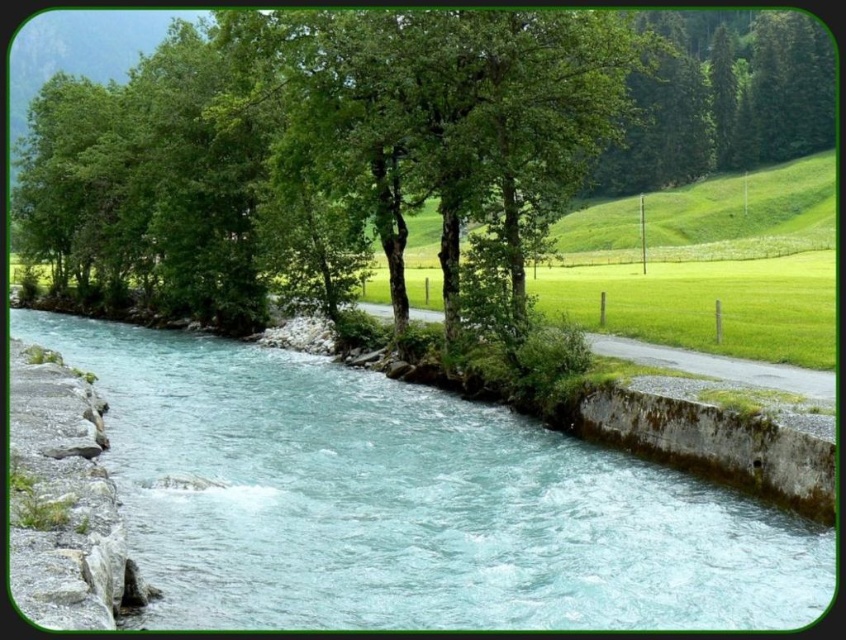
Which is more to the left, clear water at center or green leafy tree at upper center?

clear water at center is more to the left.

Who is higher up, clear water at center or green leafy tree at upper center?

Positioned higher is green leafy tree at upper center.

Is point (544, 609) positioned behind point (146, 48)?

No, it is not.

Locate an element on the screen. clear water at center is located at coordinates (408, 502).